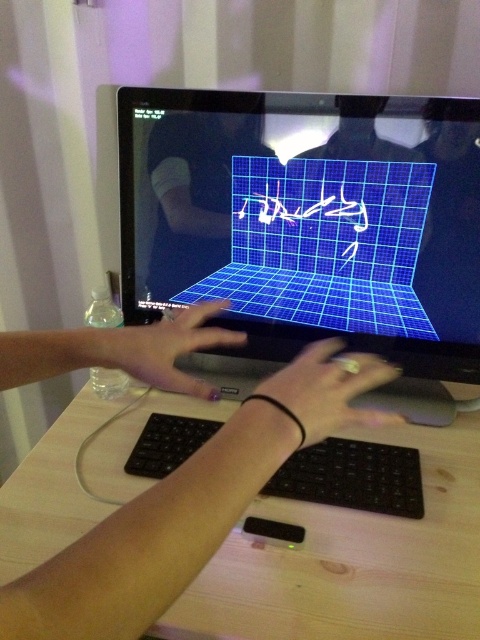
You need to place your hand on the black matte keyboard at center without touching the matte black hand at center. Is this possible?

The black matte keyboard at center might be wider than the matte black hand at center, so it is possible to place your hand on the keyboard without touching the other hand.

You are a person who wants to place a small electronic device on the desk next to the black glossy monitor at center. Considering the size of the matte black hand at center, will the device fit comfortably without overlapping?

The black glossy monitor at center is bigger than the matte black hand at center. Since the hand can comfortably rest on the monitor edge, the small electronic device should fit next to the monitor without overlapping, as the hand size indicates sufficient desk space.

You are a person who wants to reach the matte black hand at center without moving the black matte keyboard at center. Is this possible?

The black matte keyboard at center is further to the viewer than the matte black hand at center, so you can reach the matte black hand at center without moving the keyboard since it is closer to you.